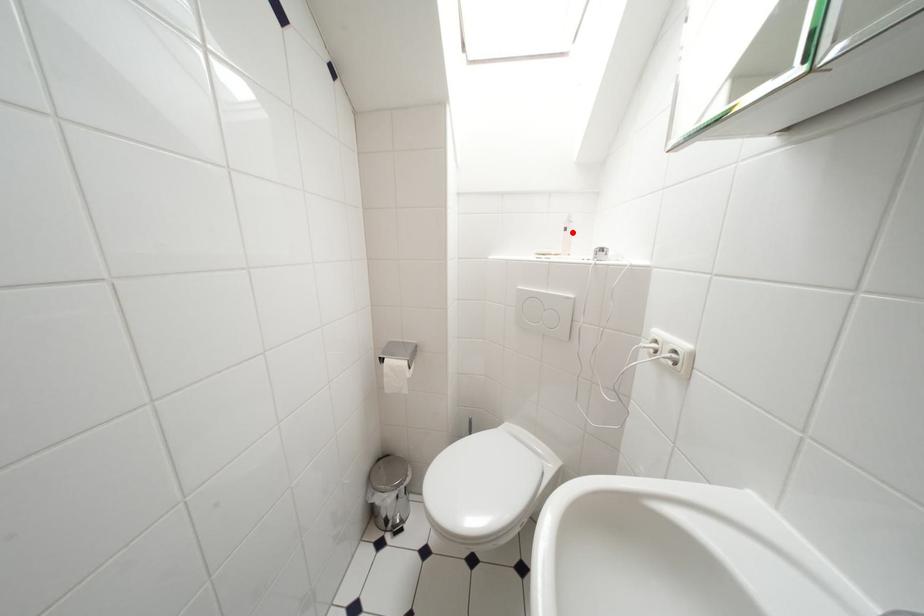
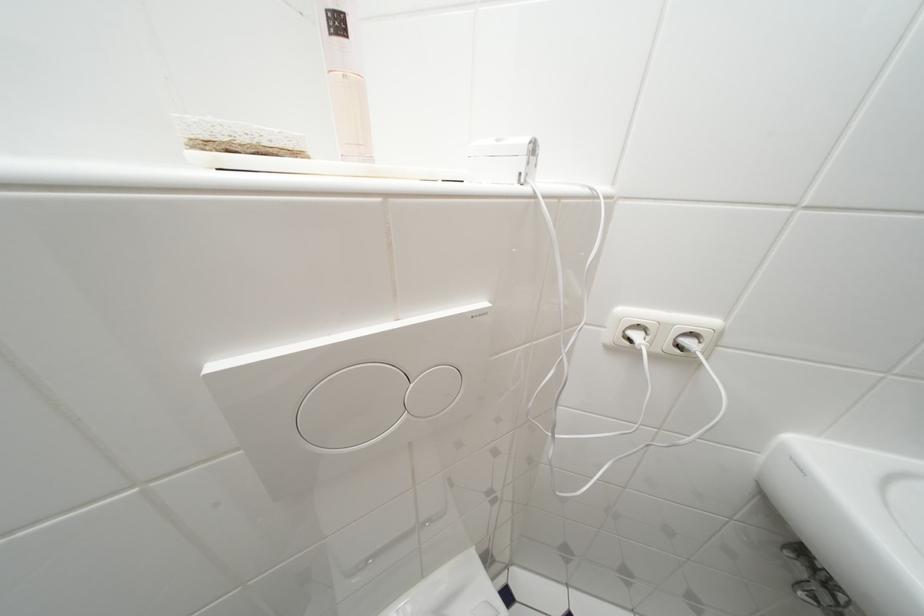
Where in the second image is the point corresponding to the highlighted location from the first image?

(345, 26)